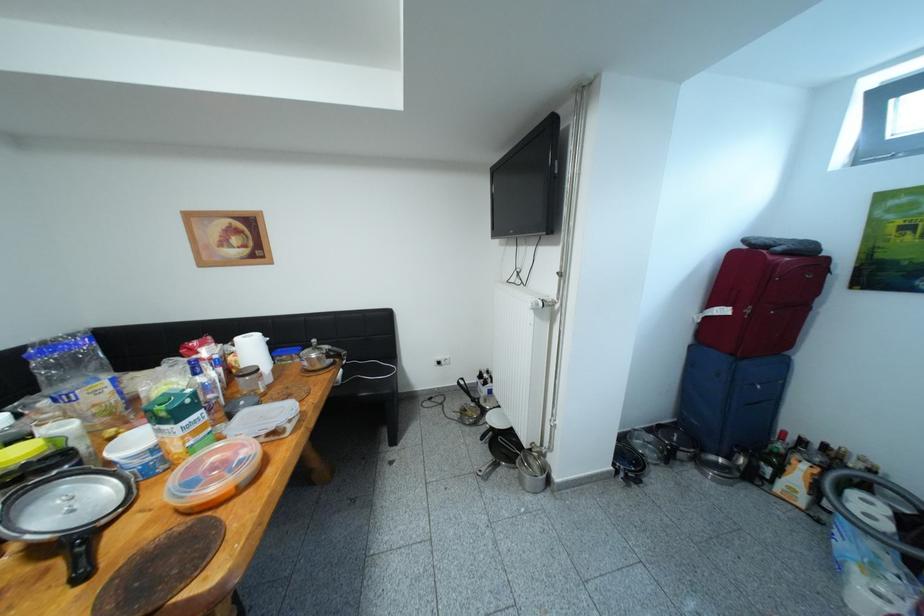
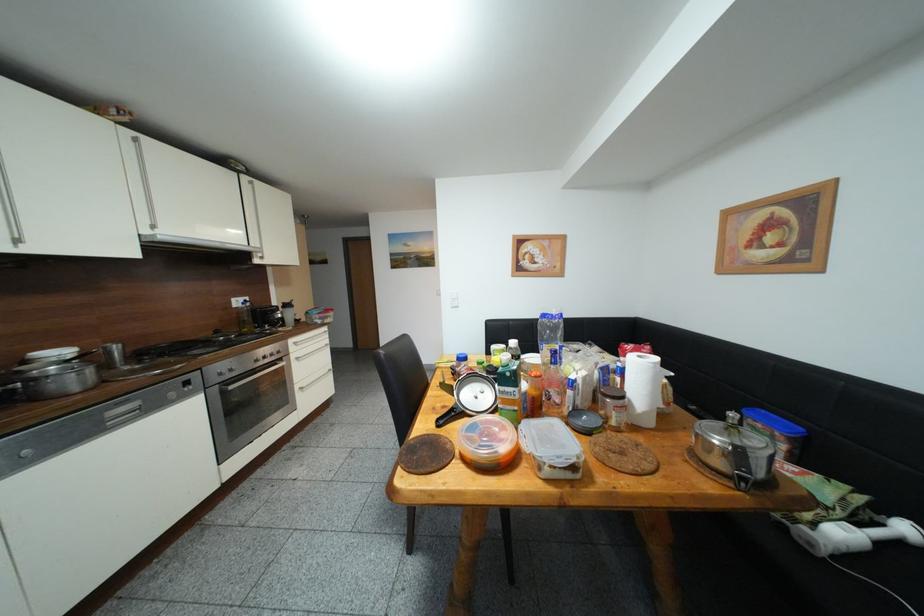
Question: How did the camera likely rotate?

Choices:
 (A) Left
 (B) Right
 (C) Up
 (D) Down

Answer: (A)